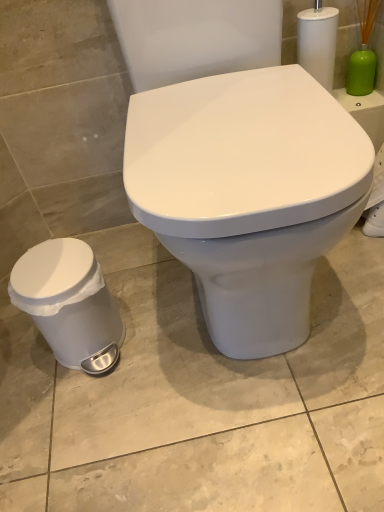
This screenshot has width=384, height=512. What are the coordinates of `empty space that is ontop of white plastic trash can at lower left (from a real-world perspective)` in the screenshot? It's located at (54, 263).